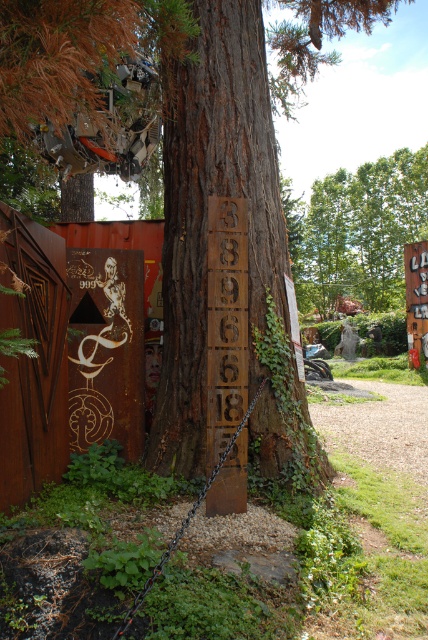
You are standing in front of the tree with the wooden board and numbers. There is a point marked at coordinates (x=356, y=230). Can you determine if this point is located on the tree or somewhere else in the scene?

The point at coordinates (x=356, y=230) is on the green leafy tree at upper center, so yes, it is located on the tree.

You are an artist planning to paint the green leafy tree at upper center and the wooden sign at right. If you want to make sure both elements are proportionally accurate in size, what should you consider based on their sizes?

The green leafy tree at upper center is bigger than the wooden sign at right, so you should paint the green leafy tree at upper center larger than the wooden sign at right to maintain proportional accuracy.

You are standing in front of the brown rough tree trunk at center and the green leafy tree at upper center. Which tree is positioned more to the left side?

The brown rough tree trunk at center is positioned more to the left side than the green leafy tree at upper center.